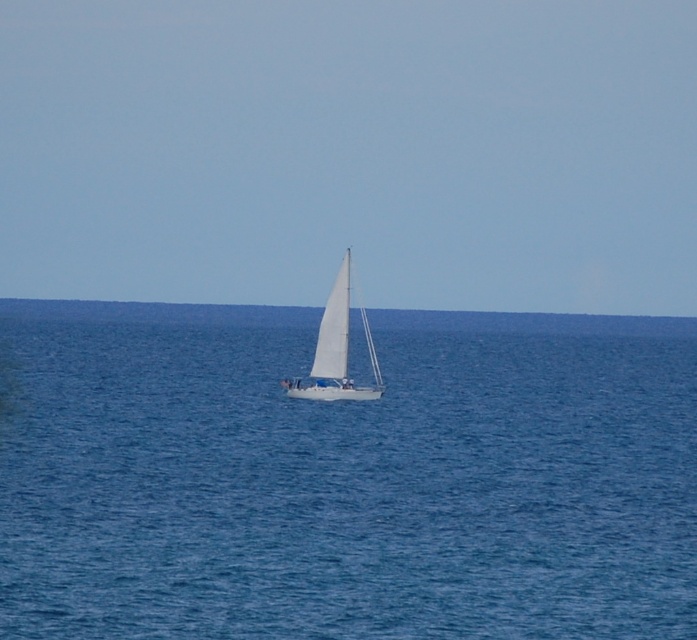
You are an observer standing on the shore looking at the seascape. Which object between the blue water at center and the white matte sailboat at center appears taller from your viewpoint?

The blue water at center appears taller than the white matte sailboat at center from the observer viewpoint.

You are standing on the shore and see the blue water at center and the white matte sailboat at center. Which object is located to the right of the other?

The blue water at center is positioned on the right side of white matte sailboat at center.